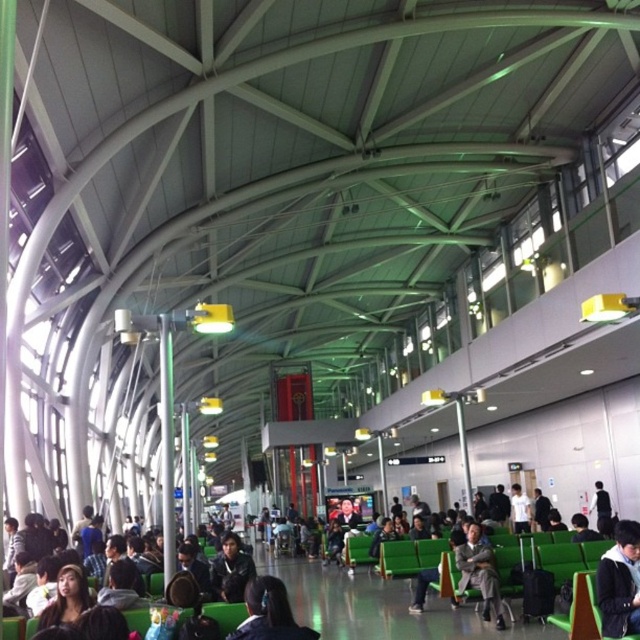
Question: Estimate the real-world distances between objects in this image. Which object is closer to the black fabric jacket at center?

Choices:
 (A) dark gray suit at center
 (B) white matte shirt at center
 (C) dark blue fabric jacket at lower right

Answer: (B)

Question: Which object is farther from the camera taking this photo?

Choices:
 (A) dark blue fabric jacket at lower right
 (B) white matte shirt at center

Answer: (B)

Question: Can you confirm if dark blue fabric jacket at lower right is wider than dark hair at center?

Choices:
 (A) no
 (B) yes

Answer: (A)

Question: Does black leather jacket at center have a lesser width compared to black fabric jacket at center?

Choices:
 (A) yes
 (B) no

Answer: (A)

Question: Is dark blue fabric jacket at lower right positioned in front of white matte shirt at center?

Choices:
 (A) no
 (B) yes

Answer: (B)

Question: Which object appears farthest from the camera in this image?

Choices:
 (A) black leather jacket at center
 (B) white matte shirt at center
 (C) black fabric jacket at center

Answer: (B)